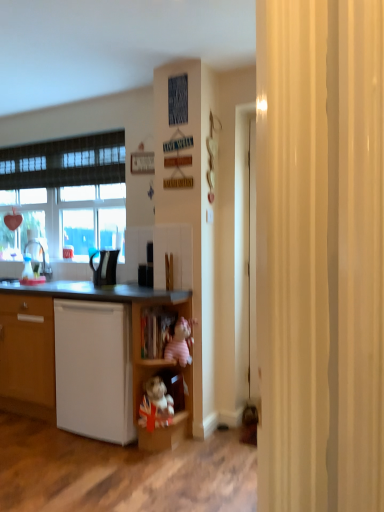
Where is `free space in front of white matte cupboard at lower left`? This screenshot has width=384, height=512. free space in front of white matte cupboard at lower left is located at coordinates (121, 473).